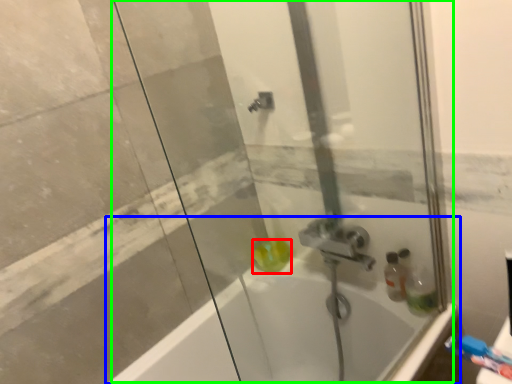
Question: Based on their relative distances, which object is farther from liquid (highlighted by a red box)? Choose from bathtub (highlighted by a blue box) and shower door (highlighted by a green box).

Choices:
 (A) bathtub
 (B) shower door

Answer: (B)